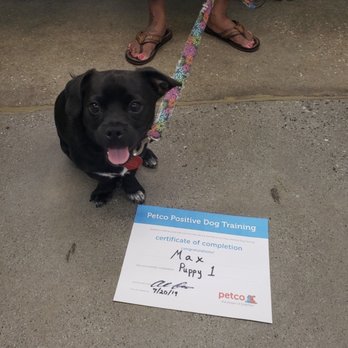
I want to click on floor, so click(x=117, y=322).